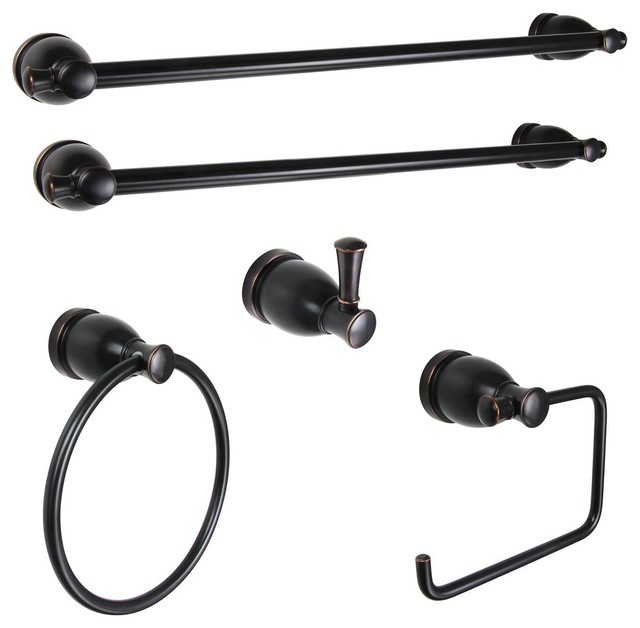
You are a GUI agent. You are given a task and a screenshot of the screen. Output one action in this format:
    pyautogui.click(x=<x>, y=<y>)
    Task: Click on the towel holders
    This screenshot has width=640, height=628.
    Given the screenshot: What is the action you would take?
    pyautogui.click(x=123, y=355), pyautogui.click(x=547, y=551), pyautogui.click(x=406, y=161), pyautogui.click(x=392, y=57)